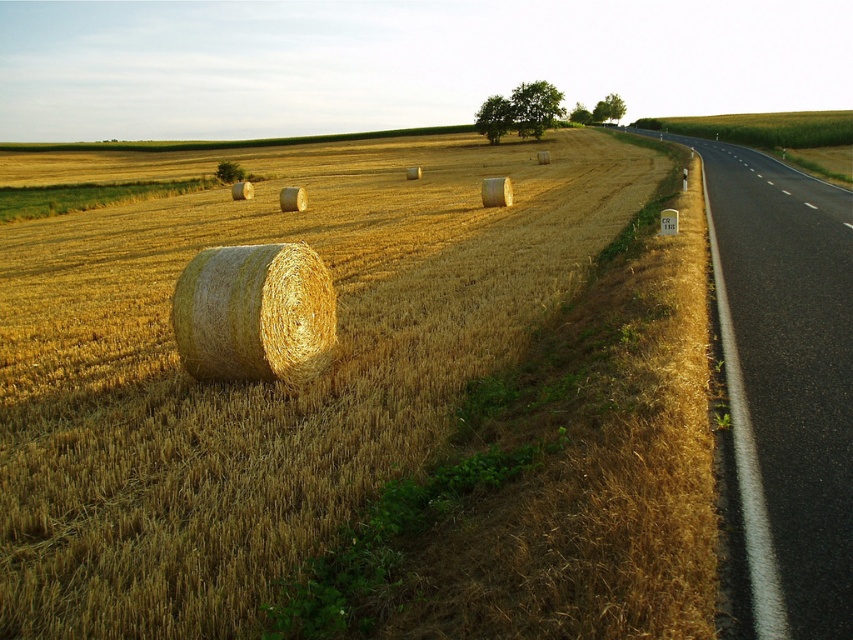
You are driving a car that is 1.8 meters wide. You want to park your car on the asphalt road at right or on the golden straw bale at center. Which location can accommodate your car without overlapping its edges?

The asphalt road at right is wider than the golden straw bale at center. Since the car is 1.8 meters wide, the asphalt road at right can accommodate the car without overlapping its edges, but the golden straw bale at center is narrower and may not provide enough space.